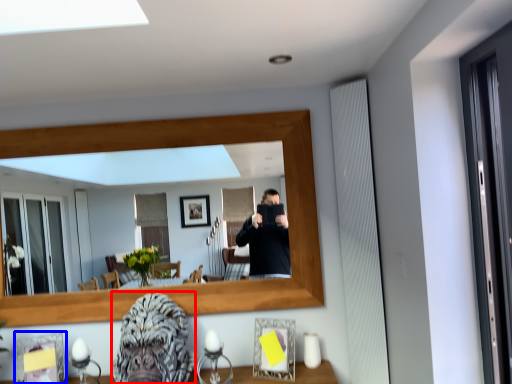
Question: Which point is further to the camera, gorilla (highlighted by a red box) or picture frame (highlighted by a blue box)?

Choices:
 (A) gorilla
 (B) picture frame

Answer: (B)